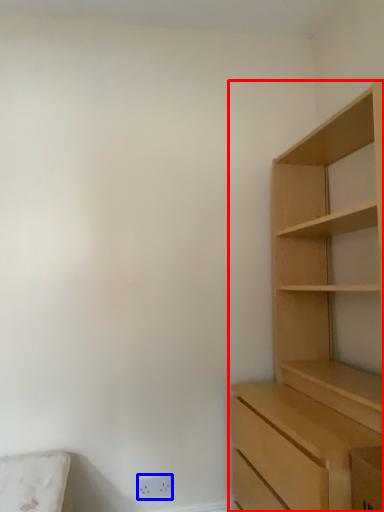
Question: Which object is closer to the camera taking this photo, cupboard (highlighted by a red box) or electric outlet (highlighted by a blue box)?

Choices:
 (A) cupboard
 (B) electric outlet

Answer: (A)